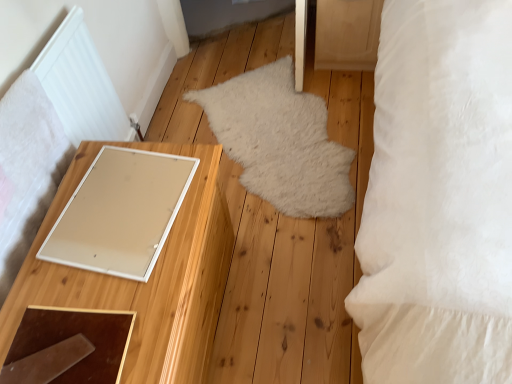
What do you see at coordinates (347, 34) in the screenshot? I see `wooden drawer at upper right` at bounding box center [347, 34].

The height and width of the screenshot is (384, 512). Describe the element at coordinates (149, 278) in the screenshot. I see `white matte mirror at left` at that location.

Where is `white fluffy rug at center`? This screenshot has width=512, height=384. white fluffy rug at center is located at coordinates (280, 141).

Which is farther, (184, 273) or (418, 159)?

The point (418, 159) is farther from the camera.

From the image's perspective, is white matte mirror at left on top of white soft pillow at right?

Incorrect, from the image's perspective, white matte mirror at left is lower than white soft pillow at right.

Is white matte mirror at left to the left of white soft pillow at right from the viewer's perspective?

Yes, white matte mirror at left is to the left of white soft pillow at right.

Between white matte mirror at left and white soft pillow at right, which one has larger size?

white soft pillow at right.

From a real-world perspective, is white fluffy rug at center located beneath wooden drawer at upper right?

Indeed, from a real-world perspective, white fluffy rug at center is positioned beneath wooden drawer at upper right.

At what (x,y) coordinates should I click in order to perform the action: click on drawer behind the white fluffy rug at center. Please return your answer as a coordinate pair (x, y). Looking at the image, I should click on (347, 34).

From the image's perspective, is white fluffy rug at center beneath wooden drawer at upper right?

Indeed, from the image's perspective, white fluffy rug at center is shown beneath wooden drawer at upper right.

Is white fluffy rug at center situated inside white soft pillow at right or outside?

white fluffy rug at center is not enclosed by white soft pillow at right.

From the picture: From the image's perspective, relative to white soft pillow at right, is white fluffy rug at center above or below?

white fluffy rug at center is situated lower than white soft pillow at right in the image.

Identify the location of pillow that appears on the right of white fluffy rug at center. (439, 198).

Consider the image. Is white fluffy rug at center directly adjacent to white soft pillow at right?

No, white fluffy rug at center is not with white soft pillow at right.

Could you tell me if white glossy board at left is turned towards white fluffy rug at center?

No, white glossy board at left is not turned towards white fluffy rug at center.

Which object is closer to the camera taking this photo, white glossy board at left or white fluffy rug at center?

Positioned in front is white glossy board at left.

You are a GUI agent. You are given a task and a screenshot of the screen. Output one action in this format:
    pyautogui.click(x=<x>, y=<y>)
    Task: Click on the pad that is below the white fluffy rug at center (from the image's perspective)
    
    Given the screenshot: What is the action you would take?
    pyautogui.click(x=120, y=213)

From a real-world perspective, who is located higher, white glossy board at left or white fluffy rug at center?

From a 3D spatial view, white glossy board at left is above.

Between white soft pillow at right and wooden drawer at upper right, which one has less height?

Standing shorter between the two is wooden drawer at upper right.

Is white soft pillow at right not inside wooden drawer at upper right?

Indeed, white soft pillow at right is completely outside wooden drawer at upper right.

Considering the relative sizes of white soft pillow at right and wooden drawer at upper right in the image provided, is white soft pillow at right smaller than wooden drawer at upper right?

No, white soft pillow at right is not smaller than wooden drawer at upper right.

From a real-world perspective, which object stands above the other?

white glossy board at left, from a real-world perspective.

Looking at their sizes, would you say white fluffy rug at center is wider or thinner than white glossy board at left?

Considering their sizes, white fluffy rug at center looks broader than white glossy board at left.

Looking at this image, can you see white fluffy rug at center touching white glossy board at left?

No, white fluffy rug at center is not beside white glossy board at left.

Which is closer to the camera, (322, 123) or (127, 267)?

The point (127, 267) is closer to the camera.

Is wooden drawer at upper right facing towards white matte mirror at left?

Yes, wooden drawer at upper right is oriented towards white matte mirror at left.

Is wooden drawer at upper right placed right next to white matte mirror at left?

There is a gap between wooden drawer at upper right and white matte mirror at left.

Find the location of a particular element. drawer above the white matte mirror at left (from the image's perspective) is located at coordinates (347, 34).

How many degrees apart are the facing directions of wooden drawer at upper right and white matte mirror at left?

There is a 92.4-degree angle between the facing directions of wooden drawer at upper right and white matte mirror at left.

Find the location of a particular element. This screenshot has height=384, width=512. pillow in front of the white matte mirror at left is located at coordinates (439, 198).

Identify the location of drawer above the white fluffy rug at center (from a real-world perspective). (347, 34).

Based on their spatial positions, is white matte mirror at left or white glossy board at left closer to white fluffy rug at center?

Among the two, white matte mirror at left is located nearer to white fluffy rug at center.

Looking at the image, which one is located further to white matte mirror at left, white glossy board at left or wooden drawer at upper right?

wooden drawer at upper right.

From the image, which object appears to be nearer to white glossy board at left, wooden drawer at upper right or white fluffy rug at center?

white fluffy rug at center is closer to white glossy board at left.

Considering their positions, is white matte mirror at left positioned closer to white soft pillow at right than white fluffy rug at center?

The object closer to white soft pillow at right is white matte mirror at left.

Considering their positions, is white fluffy rug at center positioned closer to white glossy board at left than white matte mirror at left?

Based on the image, white matte mirror at left appears to be nearer to white glossy board at left.

Considering their positions, is white fluffy rug at center positioned further to white matte mirror at left than white soft pillow at right?

white soft pillow at right is positioned further to the anchor white matte mirror at left.

Estimate the real-world distances between objects in this image. Which object is further from white fluffy rug at center, wooden drawer at upper right or white soft pillow at right?

Among the two, white soft pillow at right is located further to white fluffy rug at center.

Which object lies nearer to the anchor point white soft pillow at right, wooden drawer at upper right or white glossy board at left?

The object closer to white soft pillow at right is white glossy board at left.

The image size is (512, 384). Identify the location of pad between wooden drawer at upper right and white matte mirror at left in the up-down direction. (120, 213).

The width and height of the screenshot is (512, 384). I want to click on mat between wooden drawer at upper right and white glossy board at left from top to bottom, so click(280, 141).

I want to click on pad between white soft pillow at right and wooden drawer at upper right along the z-axis, so click(x=120, y=213).

Where is `furniture between white soft pillow at right and wooden drawer at upper right in the front-back direction`? furniture between white soft pillow at right and wooden drawer at upper right in the front-back direction is located at coordinates (149, 278).